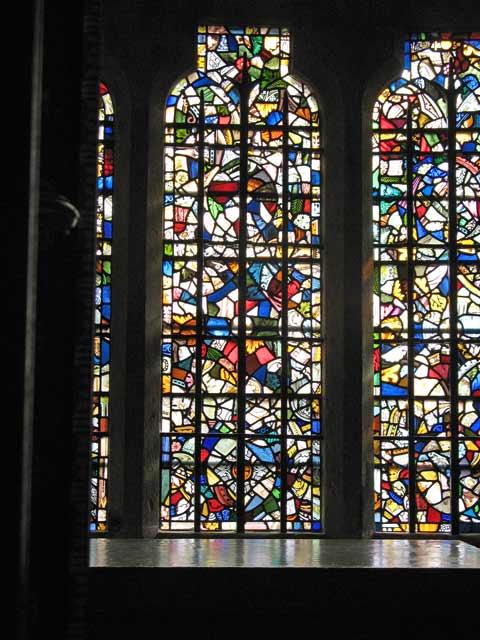
Find the location of a particular element. This screenshot has height=640, width=480. sliver of window is located at coordinates coord(108,125), coord(100,372), coord(93,474), coord(102,280).